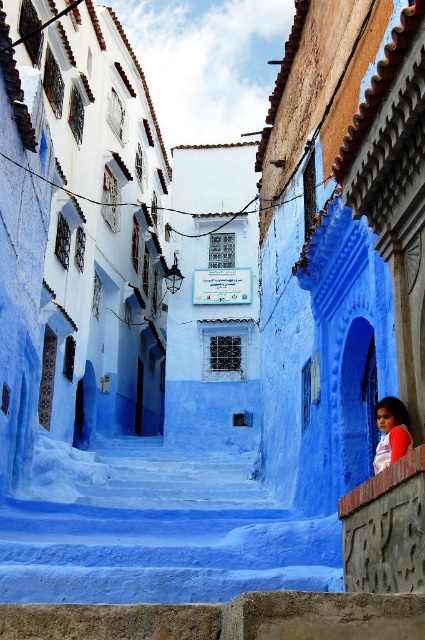
You are a tourist in Chefchaouen and want to take a photo of the smooth plaster stairs at center and the matte red shirt at right. Which object should you focus on first if you want to capture both in one frame without moving the camera?

You should focus on the smooth plaster stairs at center first because it is larger than the matte red shirt at right, allowing it to be more prominent in the frame while still including the smaller matte red shirt at right.

You are standing at the entrance of the alley in Chefchaouen and see the smooth plaster stairs at center and the matte red shirt at right. Which object is located below the other?

The smooth plaster stairs at center is positioned under matte red shirt at right.